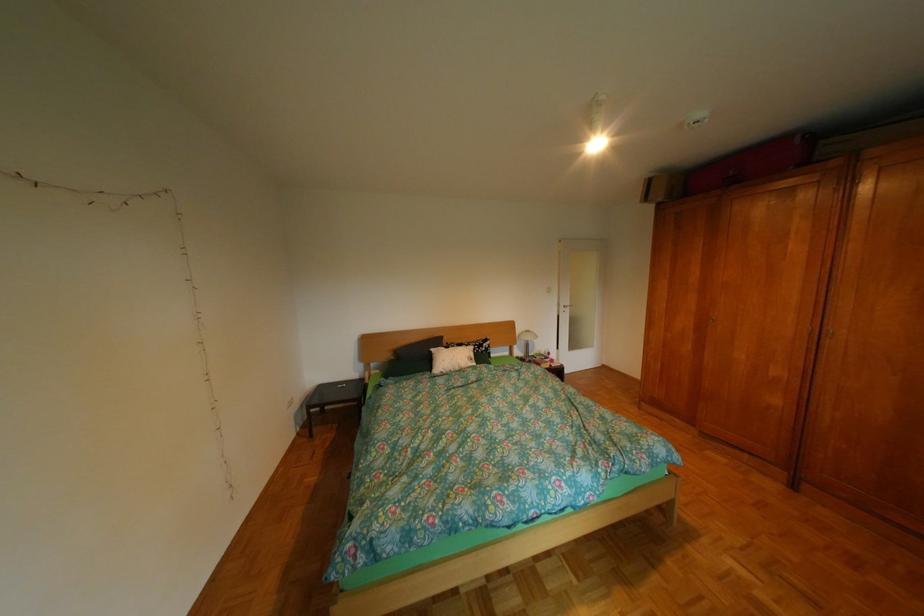
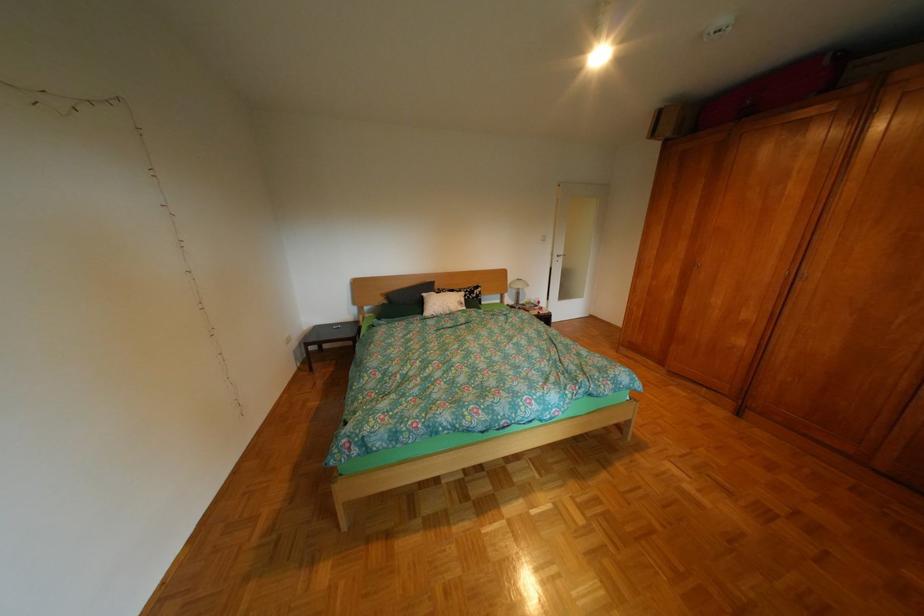
The point at (812, 142) is marked in the first image. Where is the corresponding point in the second image?

(842, 63)